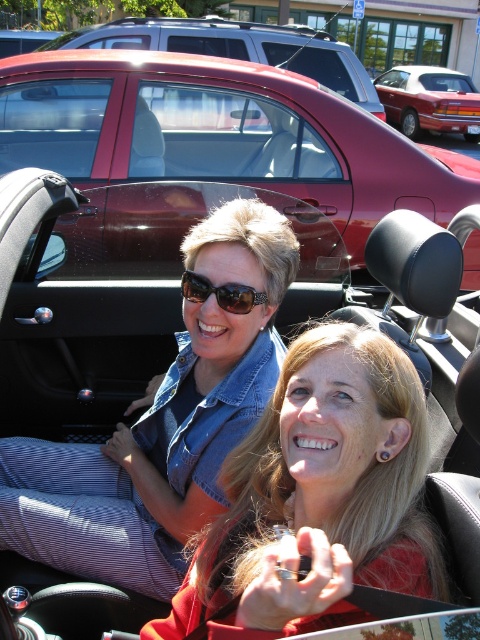
Question: Is denim jacket at upper center to the left of brown textured sunglasses at center from the viewer's perspective?

Choices:
 (A) no
 (B) yes

Answer: (B)

Question: In this image, where is denim jacket at upper center located relative to brown textured sunglasses at center?

Choices:
 (A) left
 (B) right

Answer: (A)

Question: Which point is farther from the camera taking this photo?

Choices:
 (A) (459, 115)
 (B) (450, 214)
 (C) (379, 573)

Answer: (A)

Question: Does matte black car at center appear over shiny red car at upper center?

Choices:
 (A) no
 (B) yes

Answer: (A)

Question: Which point is closer to the camera?

Choices:
 (A) denim jacket at upper center
 (B) shiny red car at upper center

Answer: (A)

Question: Estimate the real-world distances between objects in this image. Which object is farther from the brown textured sunglasses at center?

Choices:
 (A) matte black car at center
 (B) shiny maroon convertible at center
 (C) matte red sedan at center
 (D) shiny red car at upper center

Answer: (C)